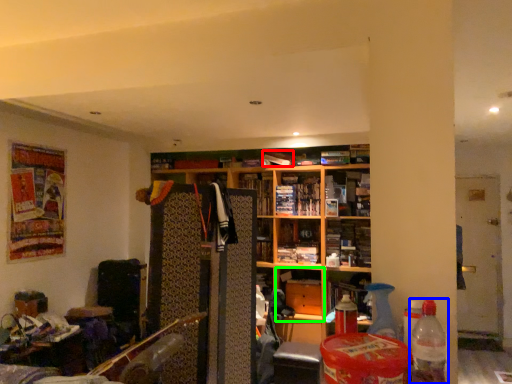
Question: Which object is positioned farthest from book (highlighted by a red box)? Select from bottle (highlighted by a blue box) and cabinet (highlighted by a green box).

Choices:
 (A) bottle
 (B) cabinet

Answer: (A)